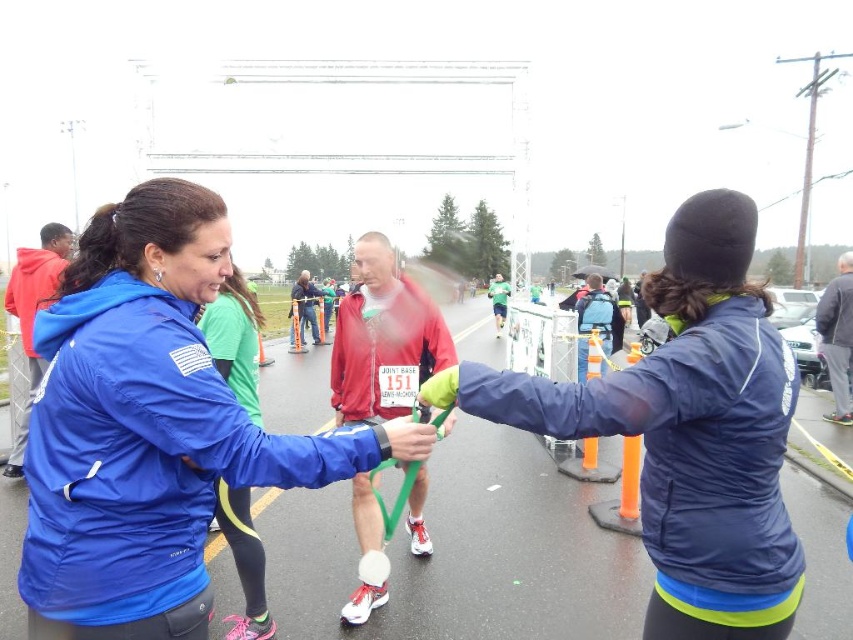
Which is in front, point (154, 436) or point (654, 307)?

Positioned in front is point (154, 436).

Between blue matte jacket at center and navy blue jacket at center, which one is positioned lower?

navy blue jacket at center is below.

Which is behind, point (132, 636) or point (759, 452)?

Positioned behind is point (759, 452).

Find the location of `blue matte jacket at center`. blue matte jacket at center is located at coordinates (149, 428).